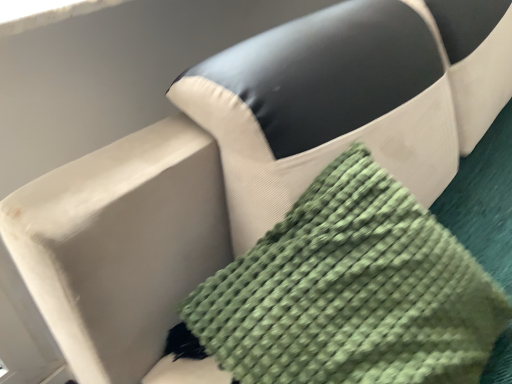
Where is `green knitted cloth at center`? green knitted cloth at center is located at coordinates (349, 293).

The width and height of the screenshot is (512, 384). What do you see at coordinates (349, 293) in the screenshot? I see `green knitted cloth at center` at bounding box center [349, 293].

At what (x,y) coordinates should I click in order to perform the action: click on green knitted cloth at center. Please return your answer as a coordinate pair (x, y). Looking at the image, I should click on (349, 293).